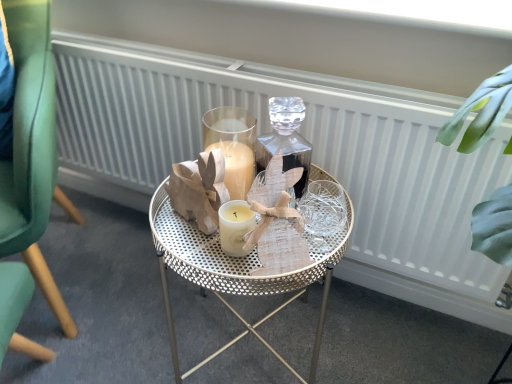
Question: Is green velvet chair at left in front of metallic gold table at center?

Choices:
 (A) no
 (B) yes

Answer: (B)

Question: From a real-world perspective, is green velvet chair at left located higher than metallic gold table at center?

Choices:
 (A) no
 (B) yes

Answer: (B)

Question: Can you see green velvet chair at left touching metallic gold table at center?

Choices:
 (A) yes
 (B) no

Answer: (B)

Question: Does green velvet chair at left have a larger size compared to metallic gold table at center?

Choices:
 (A) yes
 (B) no

Answer: (A)

Question: Can you confirm if green velvet chair at left is positioned to the left of metallic gold table at center?

Choices:
 (A) yes
 (B) no

Answer: (A)

Question: From the image's perspective, is white textured radiator at center above or below metallic gold table at center?

Choices:
 (A) above
 (B) below

Answer: (A)

Question: From a real-world perspective, is white textured radiator at center above or below metallic gold table at center?

Choices:
 (A) above
 (B) below

Answer: (A)

Question: Is point (414, 236) closer or farther from the camera than point (159, 256)?

Choices:
 (A) farther
 (B) closer

Answer: (A)

Question: In terms of width, does white textured radiator at center look wider or thinner when compared to metallic gold table at center?

Choices:
 (A) thin
 (B) wide

Answer: (A)

Question: From a real-world perspective, relative to green velvet chair at left, is white textured radiator at center vertically above or below?

Choices:
 (A) above
 (B) below

Answer: (B)

Question: Is white textured radiator at center taller or shorter than green velvet chair at left?

Choices:
 (A) short
 (B) tall

Answer: (A)

Question: Does point (144, 92) appear closer or farther from the camera than point (23, 29)?

Choices:
 (A) farther
 (B) closer

Answer: (A)

Question: Is white textured radiator at center situated inside green velvet chair at left or outside?

Choices:
 (A) inside
 (B) outside

Answer: (B)

Question: Is green velvet chair at left wider or thinner than white textured radiator at center?

Choices:
 (A) wide
 (B) thin

Answer: (A)

Question: Considering their positions, is green velvet chair at left located in front of or behind white textured radiator at center?

Choices:
 (A) front
 (B) behind

Answer: (A)